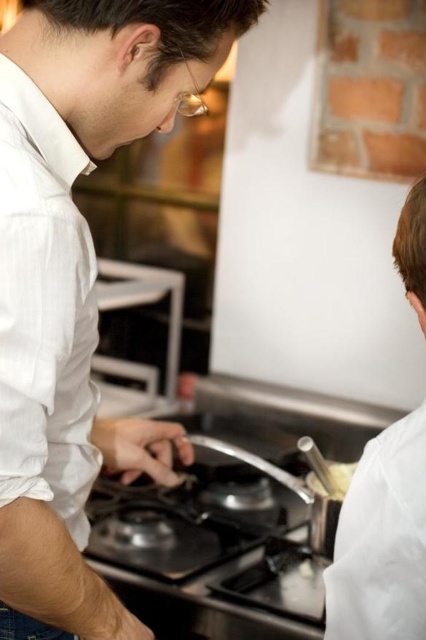
Question: From the image, what is the correct spatial relationship of white matte shirt at center in relation to white matte chef coat at right?

Choices:
 (A) above
 (B) below

Answer: (A)

Question: Among these objects, which one is farthest from the camera?

Choices:
 (A) shiny metallic pot at center
 (B) white matte shirt at center

Answer: (A)

Question: Is shiny metallic pot at center to the right of white matte chef coat at right from the viewer's perspective?

Choices:
 (A) no
 (B) yes

Answer: (A)

Question: Is white matte shirt at center smaller than shiny metallic pot at center?

Choices:
 (A) no
 (B) yes

Answer: (A)

Question: Estimate the real-world distances between objects in this image. Which object is closer to the white glossy spoon at upper right?

Choices:
 (A) white matte shirt at center
 (B) white matte chef coat at right

Answer: (B)

Question: Based on their relative distances, which object is nearer to the white matte shirt at center?

Choices:
 (A) white matte chef coat at right
 (B) white glossy spoon at upper right
 (C) shiny metallic pot at center

Answer: (A)